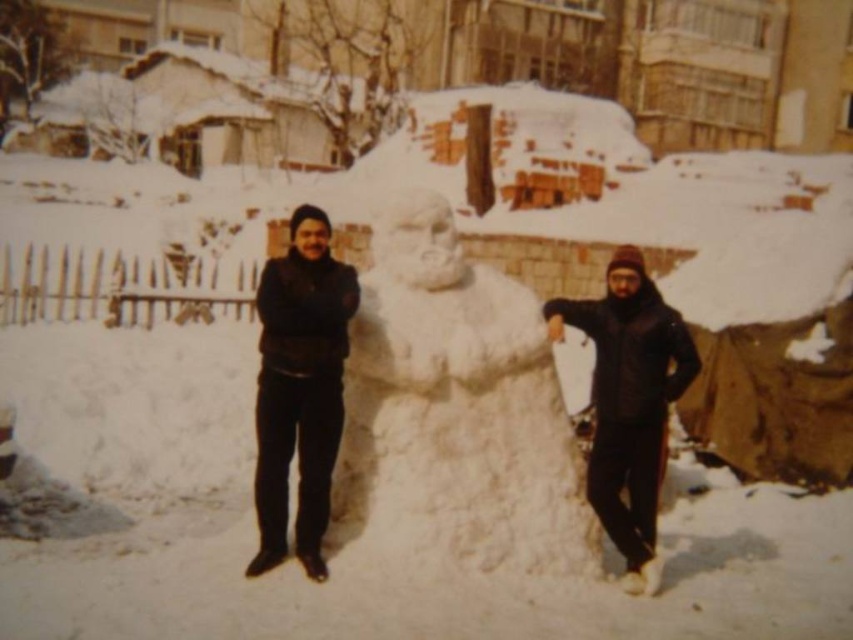
You are a delivery robot with a 30 inch wide package. You need to move between the white fluffy snowman at center and the black matte jacket at center. Can you fit through the space between them?

The white fluffy snowman at center and the black matte jacket at center are 32.07 inches apart. Since the package is 30 inches wide, there is enough space for the delivery robot to fit through the gap between them.

From the picture: You are standing at the point with coordinates point (334, 428) and want to walk towards the point with coordinates point (619, 468). Will you have to go around any obstacles between them?

Point (334, 428) is in front of point (619, 468), so you can walk directly towards point (619, 468) without needing to go around any obstacles between them.

You are standing at the point marked as point [456,410] in the image. What object are you directly facing?

You are directly facing the white fluffy snowman at center located at point [456,410].